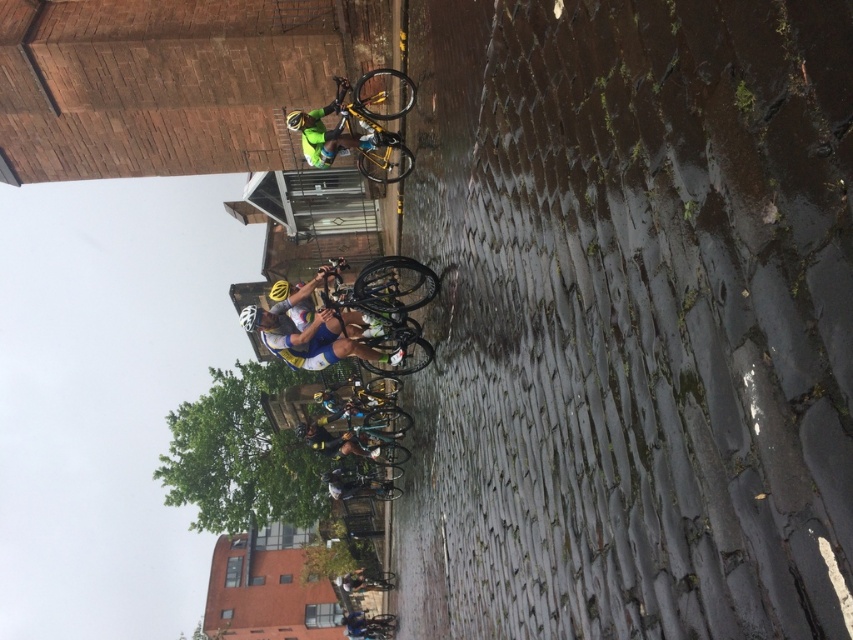
Question: Among these objects, which one is farthest from the camera?

Choices:
 (A) yellow metallic bicycle at upper center
 (B) yellow matte helmet at upper center
 (C) reflective yellow jacket at center

Answer: (C)

Question: Is the position of yellow matte helmet at upper center more distant than that of matte yellow helmet at center?

Choices:
 (A) yes
 (B) no

Answer: (B)

Question: Does yellow metallic bicycle at upper center have a lesser width compared to yellow matte helmet at center?

Choices:
 (A) no
 (B) yes

Answer: (B)

Question: Which is nearer to the reflective yellow jacket at center?

Choices:
 (A) white matte bicycle helmet at center
 (B) yellow metallic bicycle at upper center

Answer: (B)

Question: Among these points, which one is nearest to the camera?

Choices:
 (A) (334, 131)
 (B) (300, 428)

Answer: (A)

Question: Does yellow metallic bicycle at upper center appear under matte yellow helmet at center?

Choices:
 (A) no
 (B) yes

Answer: (A)